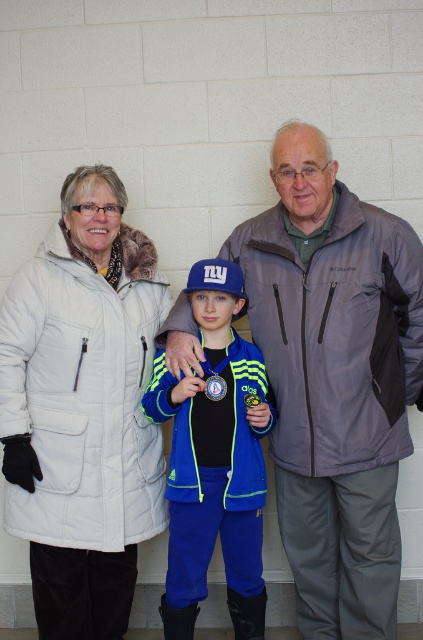
You are a photographer setting up a tripod to take a group photo of the three individuals. The tripod has a limited range and can only focus on objects within a 0.3 unit radius from the center point. Given that the gray softshell jacket at center is at point 0.595, 0.792, will the jacket be within the focus range of the tripod if the center of the frame is set at 0.5, 0.5?

The gray softshell jacket at center is located at point [335,380]. The distance from the center point [211,320] can be calculated using the Euclidean distance formula. The difference in the x coordinates is 0.095 and in the y coordinates is 0.292. Squaring these differences gives 0.009 and 0.085, respectively. Adding them together equals 0.094, and the square root is approximately 0.307. Since this distance exceeds the 0.3 unit radius, the jacket will be slightly outside the focus range of the tripod.

You are a photographer positioned at the origin point of the image. You need to focus your camera on the gray softshell jacket at center. What are the coordinates where you should aim your camera?

The coordinates where you should aim your camera are at point (335,380).

You are a photographer taking a group photo of the white puffy coat at left and the blue fleece jacket at center. Which person should you adjust to be closer to the camera to ensure both are in focus?

The blue fleece jacket at center should be moved closer to the camera because the white puffy coat at left is already closer to the viewer. Aligning them at a similar distance will help both be in focus.